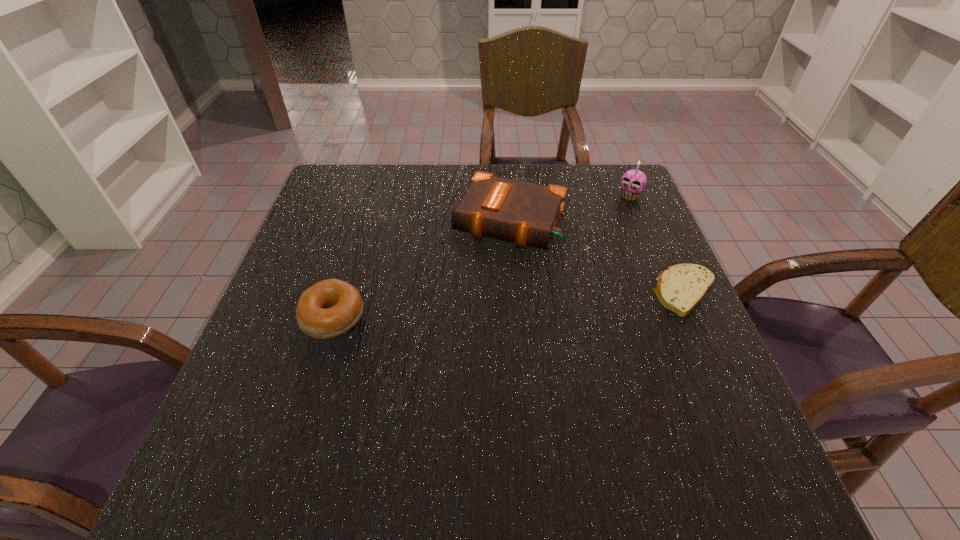
Identify the location of blank space at the far edge of the desktop. The height and width of the screenshot is (540, 960). (485, 163).

I want to click on vacant space at the near edge of the desktop, so coord(553,428).

The image size is (960, 540). In the image, there is a desktop. In order to click on free space at the left edge in this screenshot , I will do `click(307, 369)`.

At what (x,y) coordinates should I click in order to perform the action: click on free region at the right edge of the desktop. Please return your answer as a coordinate pair (x, y). The image size is (960, 540). Looking at the image, I should click on (695, 345).

Locate an element on the screen. The image size is (960, 540). vacant space at the far right corner of the desktop is located at coordinates (644, 205).

Locate an element on the screen. The image size is (960, 540). vacant space at the near right corner of the desktop is located at coordinates click(676, 415).

This screenshot has height=540, width=960. Find the location of `vacant area that lies between the shortest object and the cupcake`. vacant area that lies between the shortest object and the cupcake is located at coordinates (658, 245).

At what (x,y) coordinates should I click in order to perform the action: click on free space between the cupcake and the third tallest object. Please return your answer as a coordinate pair (x, y). The height and width of the screenshot is (540, 960). Looking at the image, I should click on (482, 257).

You are a GUI agent. You are given a task and a screenshot of the screen. Output one action in this format:
    pyautogui.click(x=<x>, y=<y>)
    Task: Click on the vacant space that is in between the shortest object and the third tallest object
    This screenshot has width=960, height=540.
    Given the screenshot: What is the action you would take?
    pyautogui.click(x=510, y=305)

The width and height of the screenshot is (960, 540). Find the location of `vacant area that lies between the bagel and the tallest object`. vacant area that lies between the bagel and the tallest object is located at coordinates (482, 257).